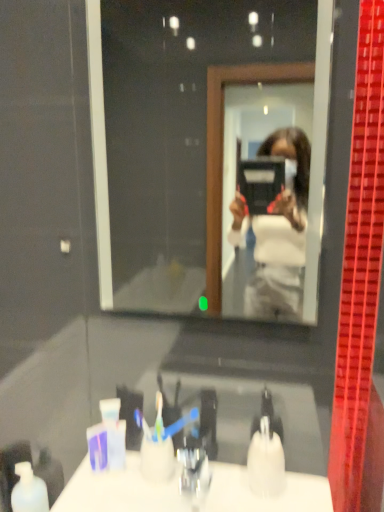
Question: Considering their positions, is white matte bottle at lower left located in front of or behind translucent plastic soap dispenser at lower center?

Choices:
 (A) front
 (B) behind

Answer: (B)

Question: Do you think white matte bottle at lower left is within translucent plastic soap dispenser at lower center, or outside of it?

Choices:
 (A) outside
 (B) inside

Answer: (A)

Question: Which is nearer to the clear glass mirror at center?

Choices:
 (A) white matte bottle at lower left
 (B) translucent plastic soap dispenser at lower center
 (C) white glossy counter top at lower center

Answer: (C)

Question: Which object is the closest to the white glossy counter top at lower center?

Choices:
 (A) white matte bottle at lower left
 (B) clear glass mirror at center
 (C) translucent plastic soap dispenser at lower center

Answer: (C)